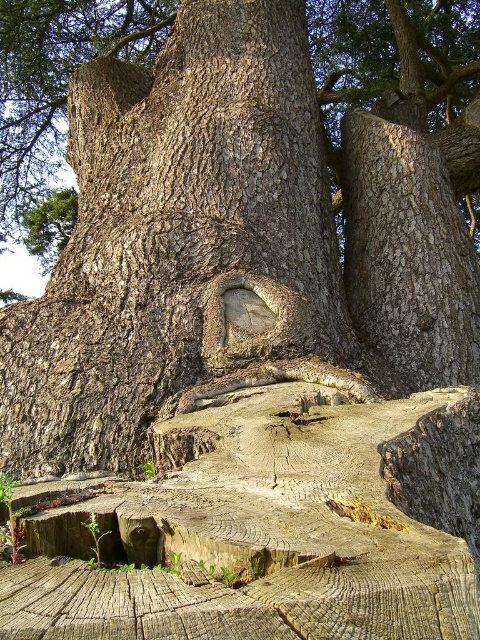
Question: Is yellowish-brown wood at center closer to camera compared to smooth brown bark at center?

Choices:
 (A) yes
 (B) no

Answer: (A)

Question: Which object is closer to the camera taking this photo?

Choices:
 (A) smooth brown bark at center
 (B) yellowish-brown wood at center

Answer: (B)

Question: Which of the following is the farthest from the observer?

Choices:
 (A) smooth brown bark at center
 (B) yellowish-brown wood at center

Answer: (A)

Question: Is yellowish-brown wood at center to the right of smooth brown bark at center from the viewer's perspective?

Choices:
 (A) no
 (B) yes

Answer: (A)

Question: Among these points, which one is nearest to the camera?

Choices:
 (A) (354, 323)
 (B) (285, 612)

Answer: (B)

Question: Considering the relative positions of yellowish-brown wood at center and smooth brown bark at center in the image provided, where is yellowish-brown wood at center located with respect to smooth brown bark at center?

Choices:
 (A) left
 (B) right

Answer: (A)